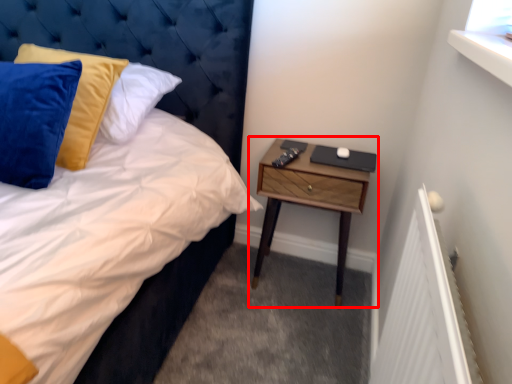
Question: In this image, where is nightstand (annotated by the red box) located relative to headboard?

Choices:
 (A) right
 (B) left

Answer: (A)